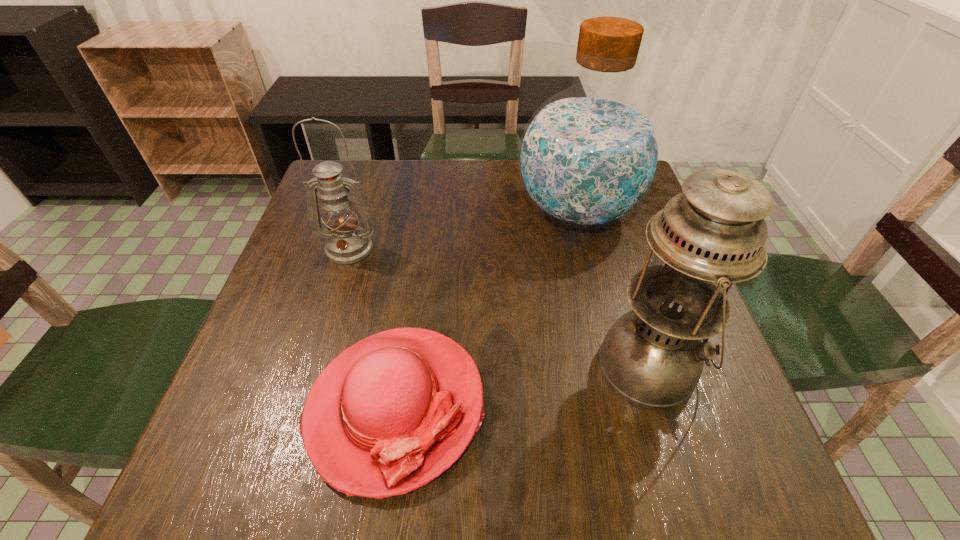
In the image, there is a desktop. Identify the location of free space at the right edge. The width and height of the screenshot is (960, 540). (598, 233).

You are a GUI agent. You are given a task and a screenshot of the screen. Output one action in this format:
    pyautogui.click(x=<x>, y=<y>)
    Task: Click on the vacant area at the near right corner of the desktop
    The width and height of the screenshot is (960, 540).
    Given the screenshot: What is the action you would take?
    pyautogui.click(x=710, y=505)

The image size is (960, 540). Find the location of `free spot between the taller oil lamp and the hat`. free spot between the taller oil lamp and the hat is located at coordinates (522, 386).

The width and height of the screenshot is (960, 540). What are the coordinates of `free spot between the left oil lamp and the taller oil lamp` in the screenshot? It's located at (499, 307).

Image resolution: width=960 pixels, height=540 pixels. I want to click on free spot between the water jug and the farther oil lamp, so click(463, 230).

The image size is (960, 540). I want to click on free space between the taller oil lamp and the shortest object, so click(522, 386).

In order to click on free space between the water jug and the shortest object in this screenshot , I will do `click(486, 309)`.

The height and width of the screenshot is (540, 960). I want to click on vacant area between the right oil lamp and the water jug, so click(613, 288).

Locate an element on the screen. The width and height of the screenshot is (960, 540). vacant area that lies between the right oil lamp and the water jug is located at coordinates (613, 288).

In order to click on unoccupied position between the water jug and the nearer oil lamp in this screenshot , I will do `click(613, 288)`.